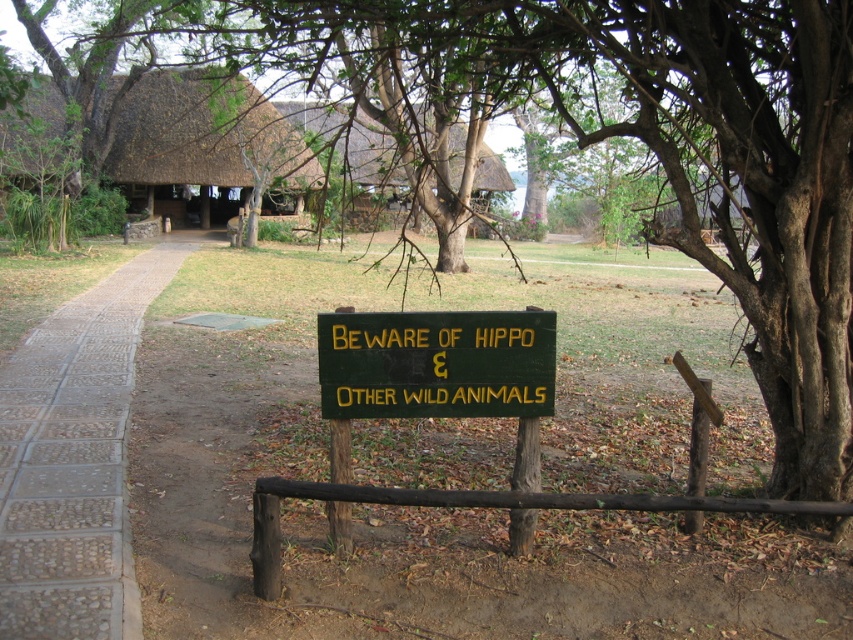
Is point (96, 429) farther from camera compared to point (366, 168)?

No, (96, 429) is in front of (366, 168).

Who is positioned more to the left, pebble stone path at left or thatched roof hut at upper center?

From the viewer's perspective, pebble stone path at left appears more on the left side.

Does point (22, 385) come farther from viewer compared to point (498, 161)?

No, it is not.

What are the coordinates of `pebble stone path at left` in the screenshot? It's located at (74, 460).

Can you confirm if green painted wood sign at center is shorter than thatched roof hut at upper center?

Correct, green painted wood sign at center is not as tall as thatched roof hut at upper center.

Who is more distant from viewer, (486, 387) or (355, 164)?

Positioned behind is point (355, 164).

Find the location of a particular element. green painted wood sign at center is located at coordinates (436, 364).

Is pebble stone path at left smaller than green painted wood sign at center?

Actually, pebble stone path at left might be larger than green painted wood sign at center.

Based on the photo, is pebble stone path at left taller than green painted wood sign at center?

Indeed, pebble stone path at left has a greater height compared to green painted wood sign at center.

Which is in front, point (120, 378) or point (451, 314)?

Point (451, 314)

Identify the location of pebble stone path at left. Image resolution: width=853 pixels, height=640 pixels. (74, 460).